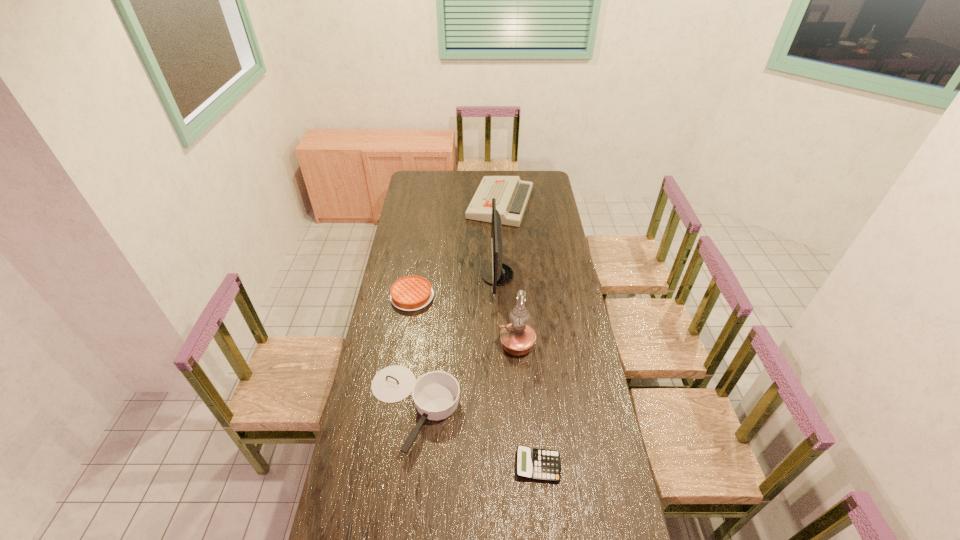
The height and width of the screenshot is (540, 960). In the image, there is a desktop. Identify the location of free space at the left edge. (389, 264).

This screenshot has height=540, width=960. In order to click on vacant space at the right edge in this screenshot , I will do `click(614, 506)`.

Where is `free spot at the far left corner of the desktop`? free spot at the far left corner of the desktop is located at coordinates (412, 181).

The image size is (960, 540). I want to click on empty location between the saucepan and the calculator, so click(475, 437).

Find the location of a particular element. This screenshot has height=540, width=960. free space between the monitor and the pie is located at coordinates (455, 286).

You are a GUI agent. You are given a task and a screenshot of the screen. Output one action in this format:
    pyautogui.click(x=<x>, y=<y>)
    Task: Click on the vacant area that lies between the calculator and the monitor
    
    Given the screenshot: What is the action you would take?
    pyautogui.click(x=517, y=370)

The image size is (960, 540). Find the location of `the second closest object to the saucepan`. the second closest object to the saucepan is located at coordinates pos(536,464).

You are a GUI agent. You are given a task and a screenshot of the screen. Output one action in this format:
    pyautogui.click(x=<x>, y=<y>)
    Task: Click on the object that is the sixth closest to the calculator
    This screenshot has width=960, height=540.
    Given the screenshot: What is the action you would take?
    pyautogui.click(x=512, y=194)

Where is `vacant space that satisfies the following two spatial constraints: 1. on the front side of the calculator; 2. on the right side of the pie`? This screenshot has width=960, height=540. vacant space that satisfies the following two spatial constraints: 1. on the front side of the calculator; 2. on the right side of the pie is located at coordinates (385, 466).